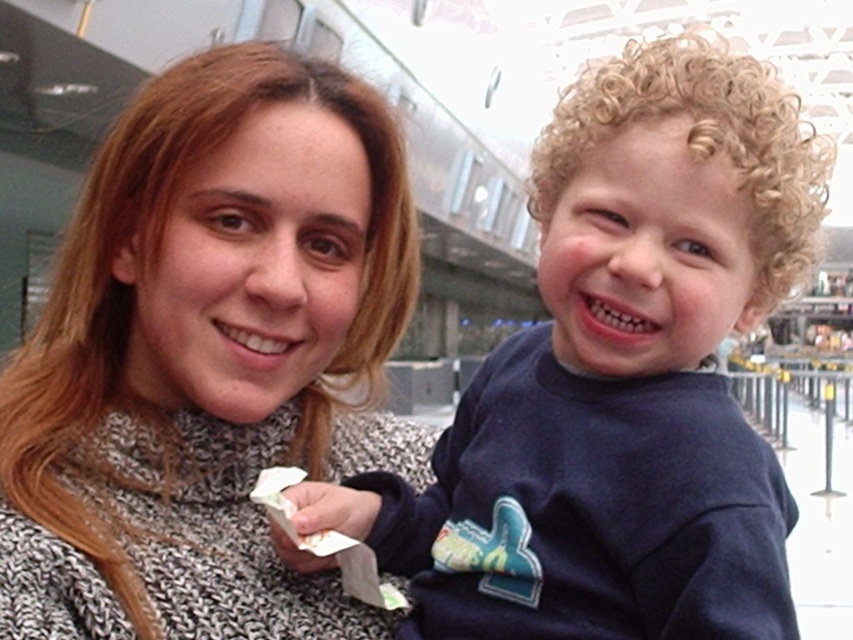
Question: Which object is farther from the camera taking this photo?

Choices:
 (A) knitted sweater at center
 (B) dark blue sweatshirt at right

Answer: (A)

Question: Where is knitted sweater at center located in relation to dark blue sweatshirt at right in the image?

Choices:
 (A) left
 (B) right

Answer: (A)

Question: Which point is farther from the camera taking this photo?

Choices:
 (A) (4, 477)
 (B) (704, 118)

Answer: (A)

Question: Does knitted sweater at center appear over dark blue sweatshirt at right?

Choices:
 (A) no
 (B) yes

Answer: (B)

Question: In this image, where is knitted sweater at center located relative to dark blue sweatshirt at right?

Choices:
 (A) right
 (B) left

Answer: (B)